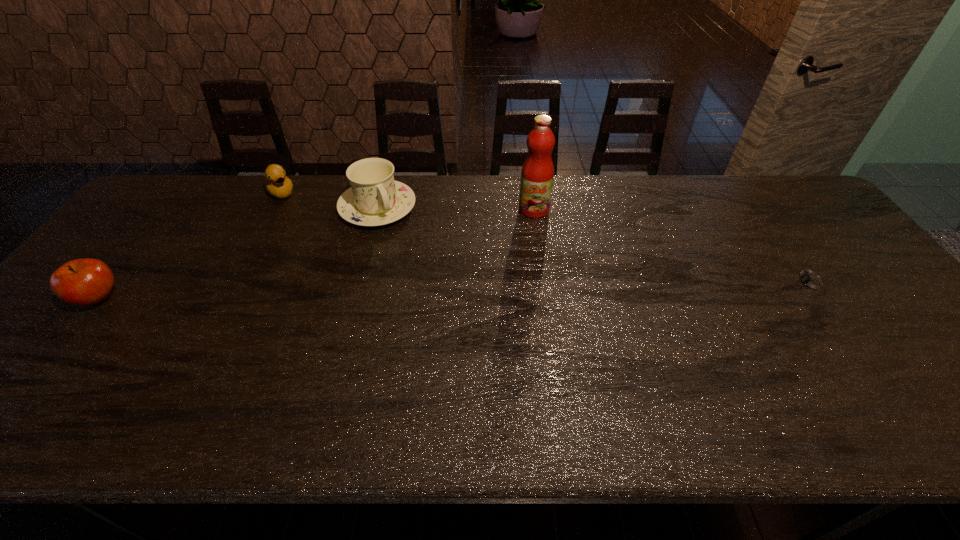
The image size is (960, 540). What are the coordinates of `vacant space in between the third object from right to left and the fourth object from left to right` in the screenshot? It's located at (456, 208).

Image resolution: width=960 pixels, height=540 pixels. In order to click on free space between the fourth object from left to right and the watch in this screenshot , I will do `click(673, 246)`.

You are a GUI agent. You are given a task and a screenshot of the screen. Output one action in this format:
    pyautogui.click(x=<x>, y=<y>)
    Task: Click on the vacant area that lies between the leftmost object and the fruit juice
    This screenshot has height=540, width=960.
    Given the screenshot: What is the action you would take?
    pyautogui.click(x=317, y=254)

The width and height of the screenshot is (960, 540). Find the location of `vacant space in between the chinaware and the second object from right to left`. vacant space in between the chinaware and the second object from right to left is located at coordinates (456, 208).

I want to click on free spot between the rightmost object and the apple, so click(455, 291).

Identify the location of vacant area that lies between the chinaware and the shortest object. The width and height of the screenshot is (960, 540). (594, 245).

The height and width of the screenshot is (540, 960). In order to click on vacant area between the third object from right to left and the duckling in this screenshot , I will do `click(329, 200)`.

Locate an element on the screen. free space between the chinaware and the rightmost object is located at coordinates (594, 245).

This screenshot has width=960, height=540. Find the location of `vacant region between the fruit juice and the apple`. vacant region between the fruit juice and the apple is located at coordinates (317, 254).

Identify which object is the fourth closest to the fourth object from right to left. Please provide its 2D coordinates. Your answer should be formatted as a tuple, i.e. [(x, y)], where the tuple contains the x and y coordinates of a point satisfying the conditions above.

[(811, 283)]